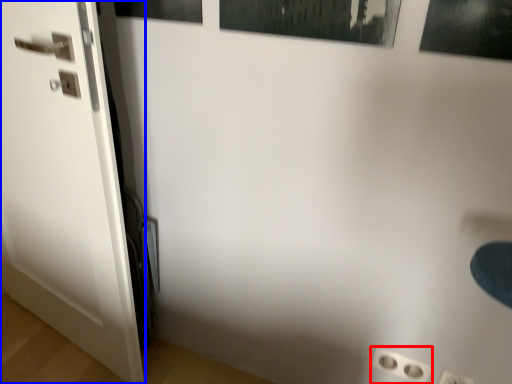
Question: Which object is further to the camera taking this photo, electric outlet (highlighted by a red box) or door (highlighted by a blue box)?

Choices:
 (A) electric outlet
 (B) door

Answer: (A)